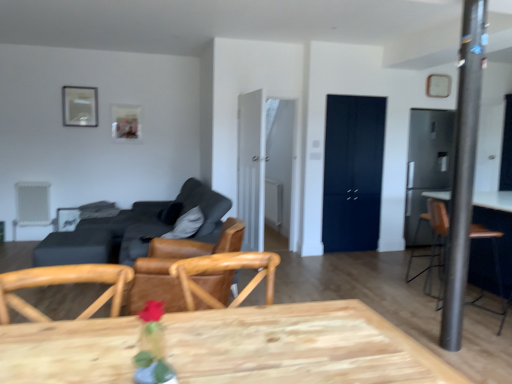
Question: Does metallic silver picture frame at upper center, the first picture frame positioned from the back, turn towards metallic pole at right?

Choices:
 (A) yes
 (B) no

Answer: (B)

Question: Is metallic silver picture frame at upper center, positioned as the third picture frame in front-to-back order, located outside metallic pole at right?

Choices:
 (A) no
 (B) yes

Answer: (B)

Question: Is metallic silver picture frame at upper center, arranged as the second picture frame when viewed from the left, bigger than metallic pole at right?

Choices:
 (A) no
 (B) yes

Answer: (A)

Question: From the image's perspective, does metallic silver picture frame at upper center, positioned as the third picture frame in front-to-back order, appear higher than metallic pole at right?

Choices:
 (A) no
 (B) yes

Answer: (B)

Question: Is metallic silver picture frame at upper center, positioned as the third picture frame in front-to-back order, taller than metallic pole at right?

Choices:
 (A) no
 (B) yes

Answer: (A)

Question: Relative to dark gray fabric couch at center-left, is wooden picture frame at upper right, marked as the 1th picture frame in a right-to-left arrangement, in front or behind?

Choices:
 (A) front
 (B) behind

Answer: (B)

Question: From their relative heights in the image, would you say wooden picture frame at upper right, the 3th picture frame when ordered from left to right, is taller or shorter than dark gray fabric couch at center-left?

Choices:
 (A) short
 (B) tall

Answer: (A)

Question: From a real-world perspective, is wooden picture frame at upper right, placed as the 1th picture frame when sorted from front to back, positioned above or below dark gray fabric couch at center-left?

Choices:
 (A) below
 (B) above

Answer: (B)

Question: Is wooden picture frame at upper right, which ranks as the 3th picture frame in back-to-front order, spatially inside dark gray fabric couch at center-left, or outside of it?

Choices:
 (A) outside
 (B) inside

Answer: (A)

Question: Is brown leather chair at center bigger or smaller than metallic silver picture frame at upper center, positioned as the third picture frame in front-to-back order?

Choices:
 (A) big
 (B) small

Answer: (A)

Question: In terms of height, does brown leather chair at center look taller or shorter compared to metallic silver picture frame at upper center, the first picture frame positioned from the back?

Choices:
 (A) short
 (B) tall

Answer: (B)

Question: Is brown leather chair at center wider or thinner than metallic silver picture frame at upper center, arranged as the second picture frame when viewed from the left?

Choices:
 (A) wide
 (B) thin

Answer: (A)

Question: Is brown leather chair at center spatially inside metallic silver picture frame at upper center, positioned as the third picture frame in front-to-back order, or outside of it?

Choices:
 (A) outside
 (B) inside

Answer: (A)

Question: Is wooden table at lower left inside the boundaries of metallic silver picture frame at upper left, the 3th picture frame positioned from the right, or outside?

Choices:
 (A) inside
 (B) outside

Answer: (B)

Question: Based on their sizes in the image, would you say wooden table at lower left is bigger or smaller than metallic silver picture frame at upper left, arranged as the 2th picture frame when viewed from the back?

Choices:
 (A) small
 (B) big

Answer: (B)